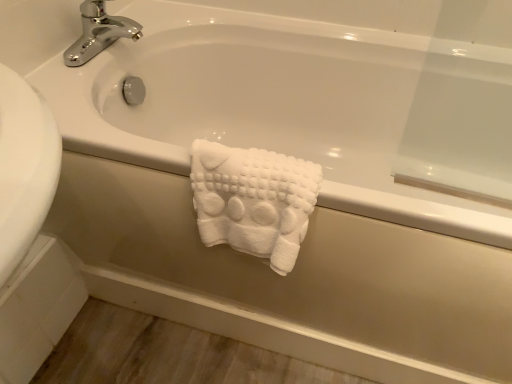
Image resolution: width=512 pixels, height=384 pixels. I want to click on free space to the left of chrome/metallic faucet at upper left, so click(65, 49).